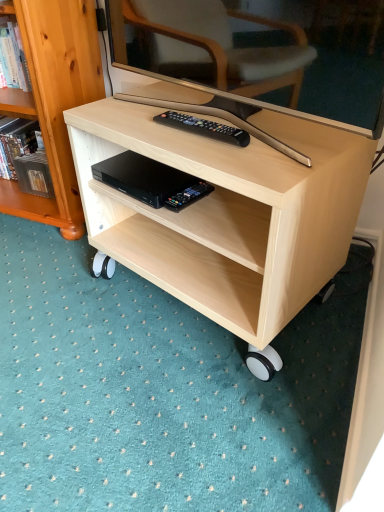
Locate an element on the screen. free space in front of light wood desk at center is located at coordinates (188, 413).